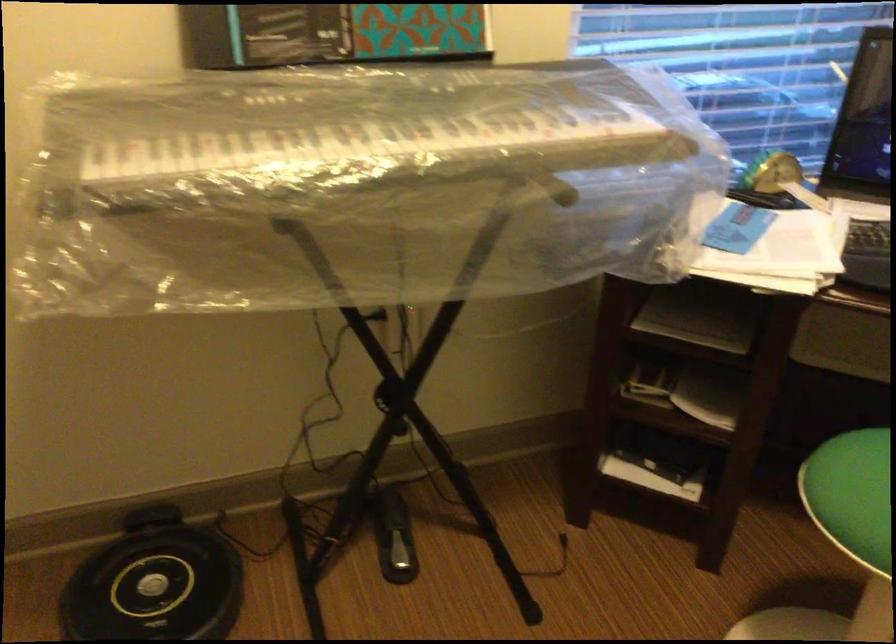
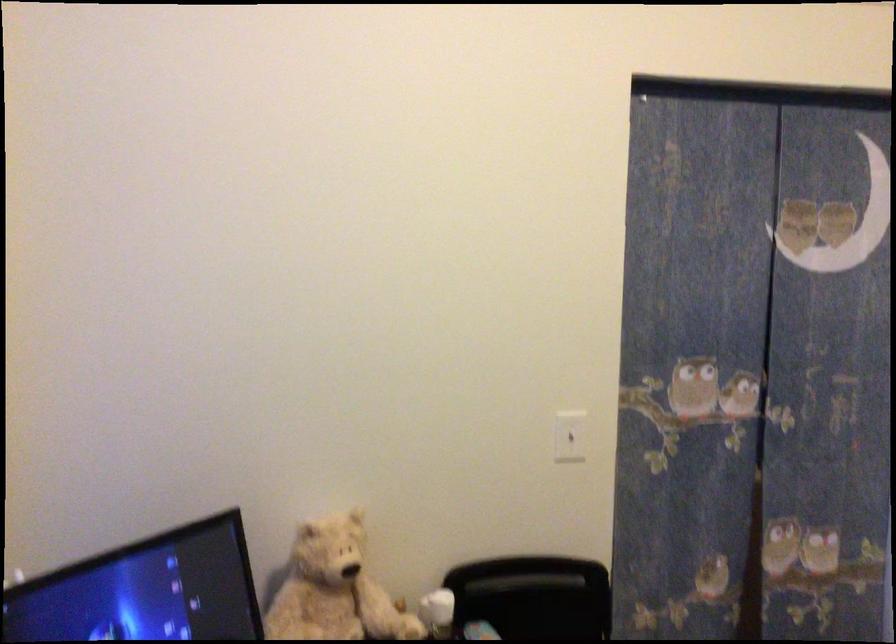
Question: The first image is from the beginning of the video and the second image is from the end. How did the camera likely rotate when shooting the video?

Choices:
 (A) Left
 (B) Right
 (C) Up
 (D) Down

Answer: (B)